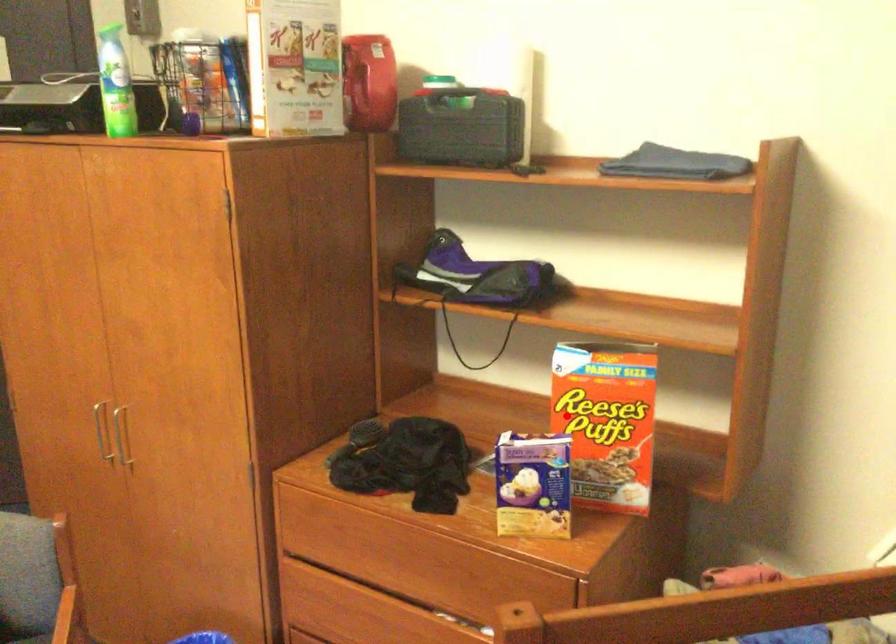
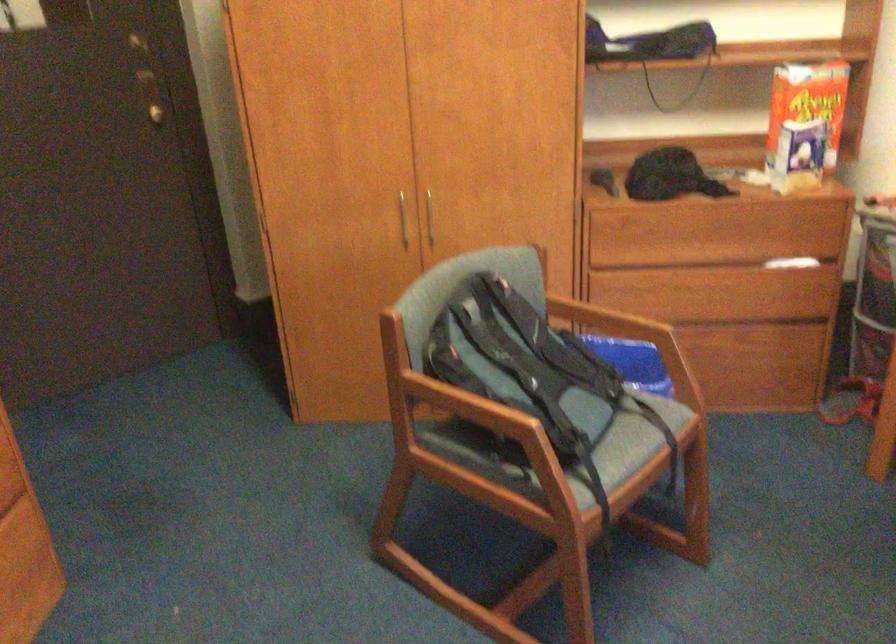
In the second image, find the point that corresponds to the highlighted location in the first image.

(807, 102)